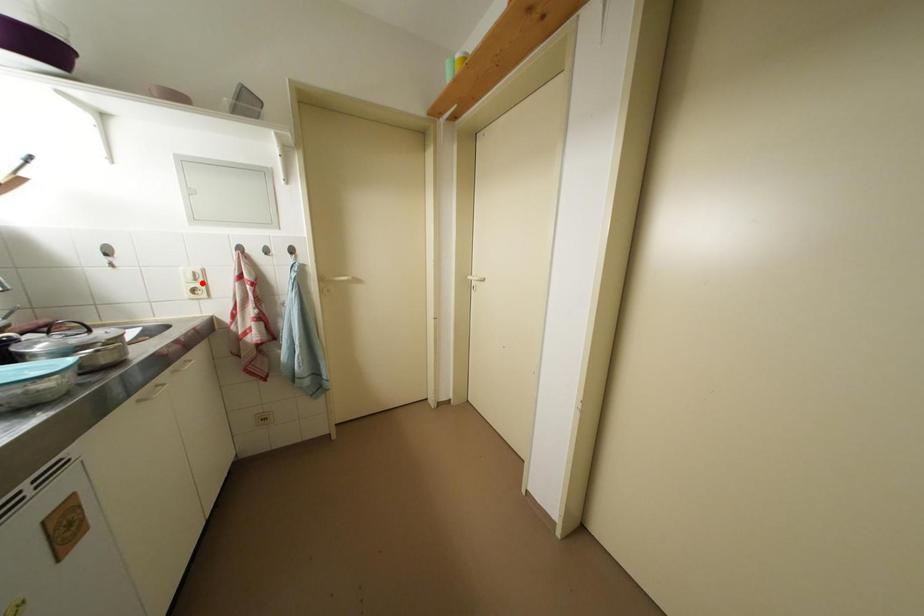
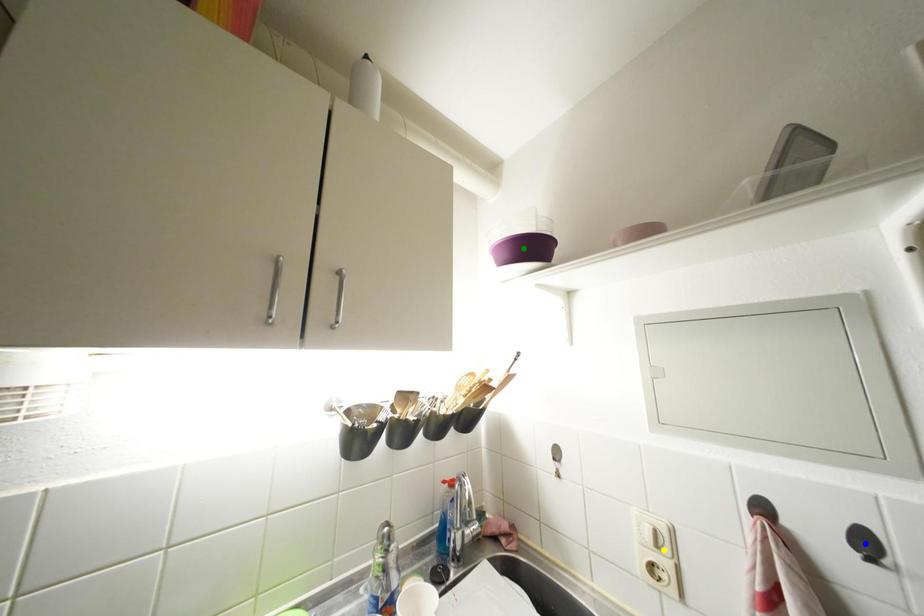
Question: I am providing you with two images of the same scene from different viewpoints. A red point is marked on the first image. You are given multiple points on the second image. Which point in image 2 represents the same 3d spot as the red point in image 1?

Choices:
 (A) green point
 (B) yellow point
 (C) blue point

Answer: (B)